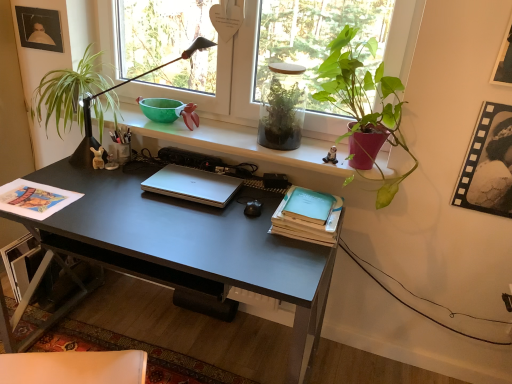
Find the location of a particular element. The height and width of the screenshot is (384, 512). free spot above light blue matte paper at center right, arranged as the 1th paperback book when ordered from the bottom (from a real-world perspective) is located at coordinates (307, 203).